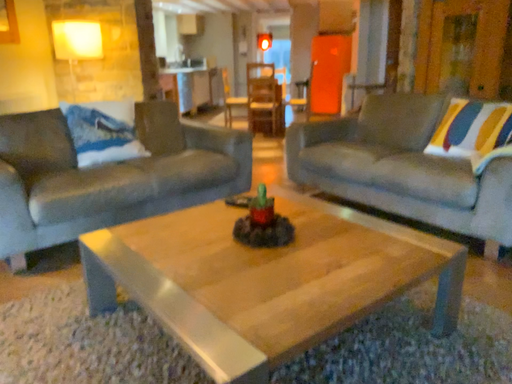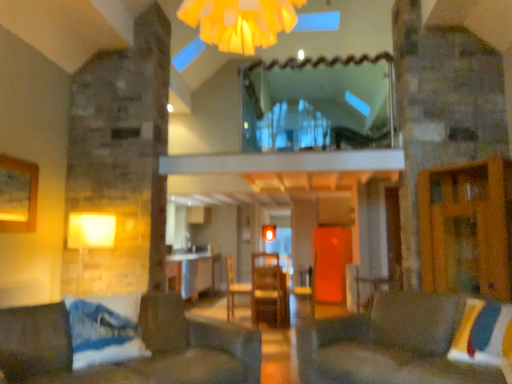
Question: How did the camera likely rotate when shooting the video?

Choices:
 (A) rotated upward
 (B) rotated downward

Answer: (A)